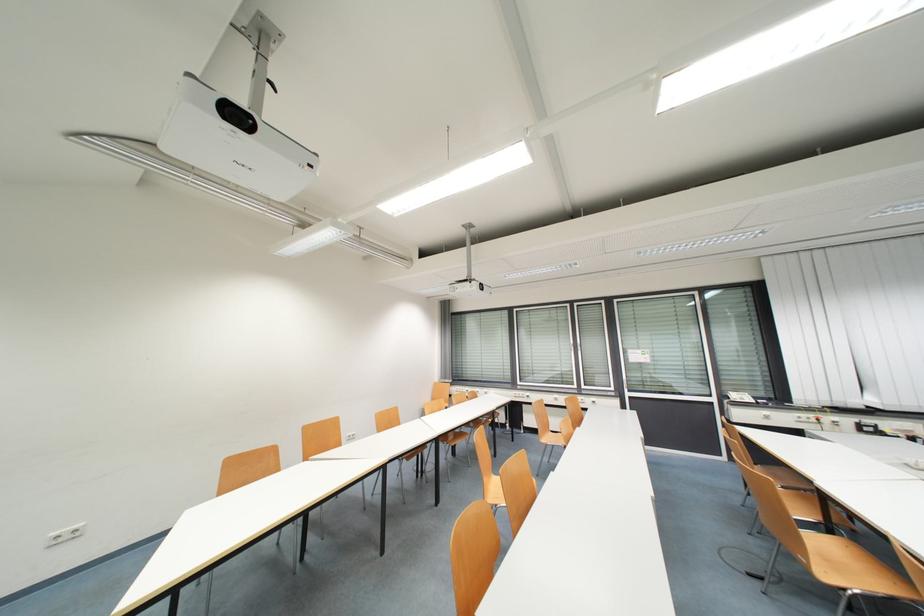
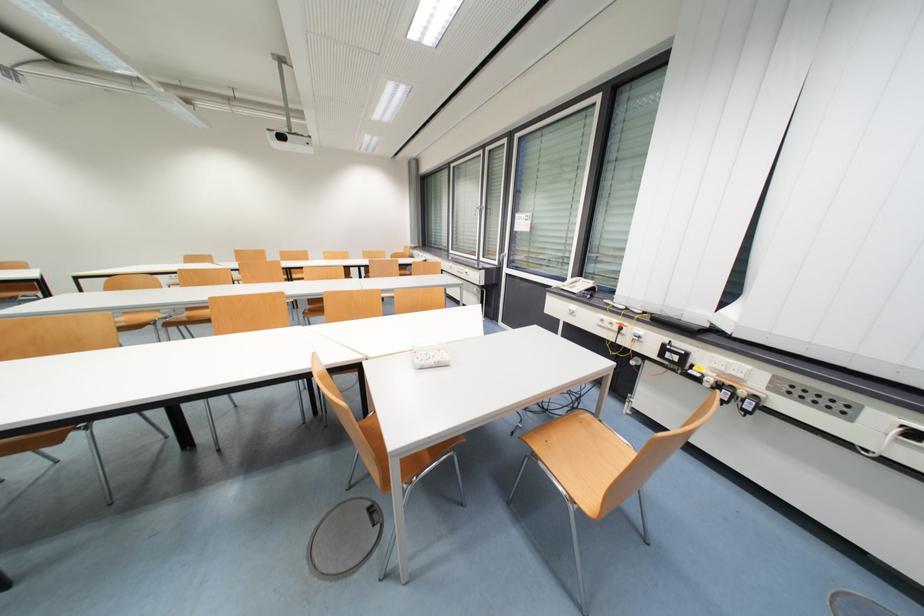
In the second image, find the point that corresponds to pixel 771 414 in the first image.

(578, 309)